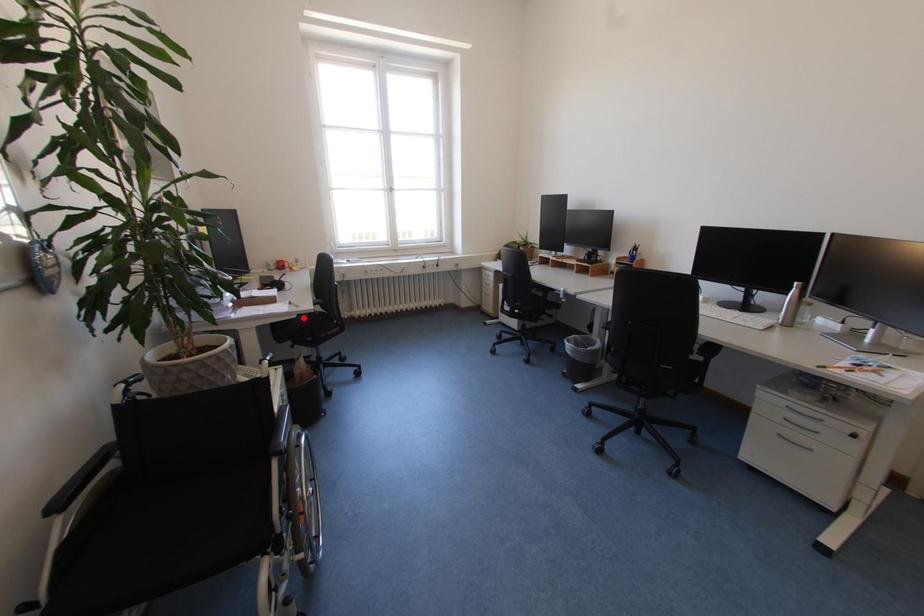
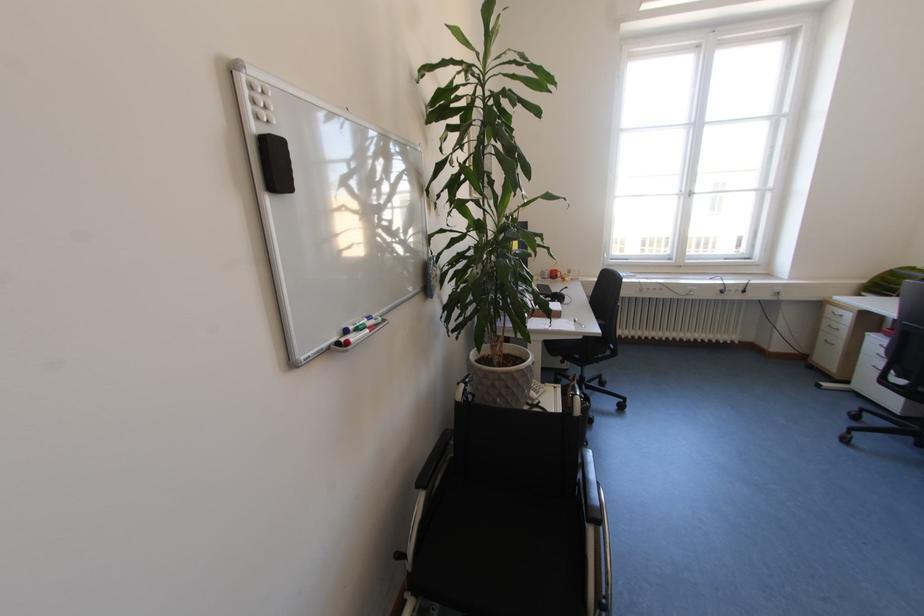
The point at the highlighted location is marked in the first image. Where is the corresponding point in the second image?

(589, 339)